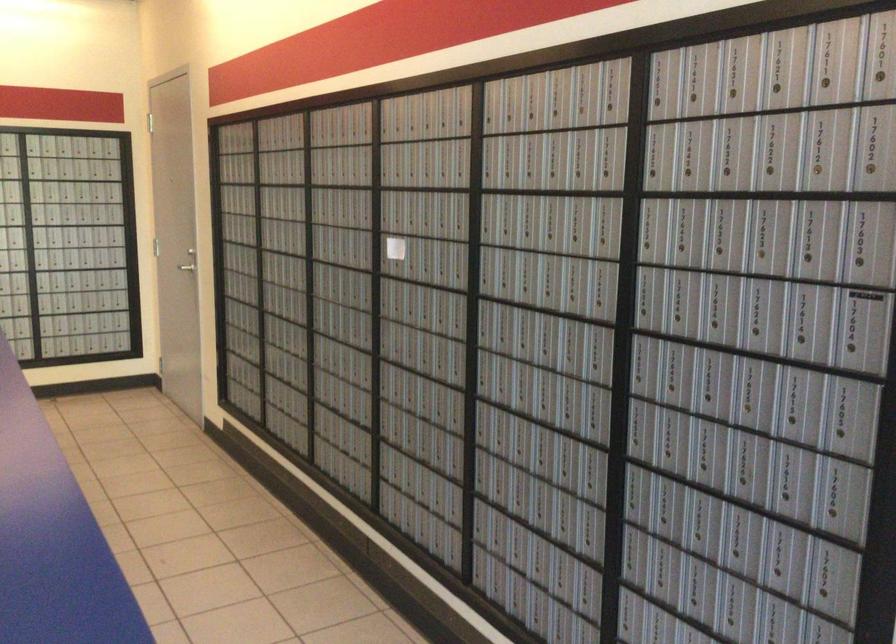
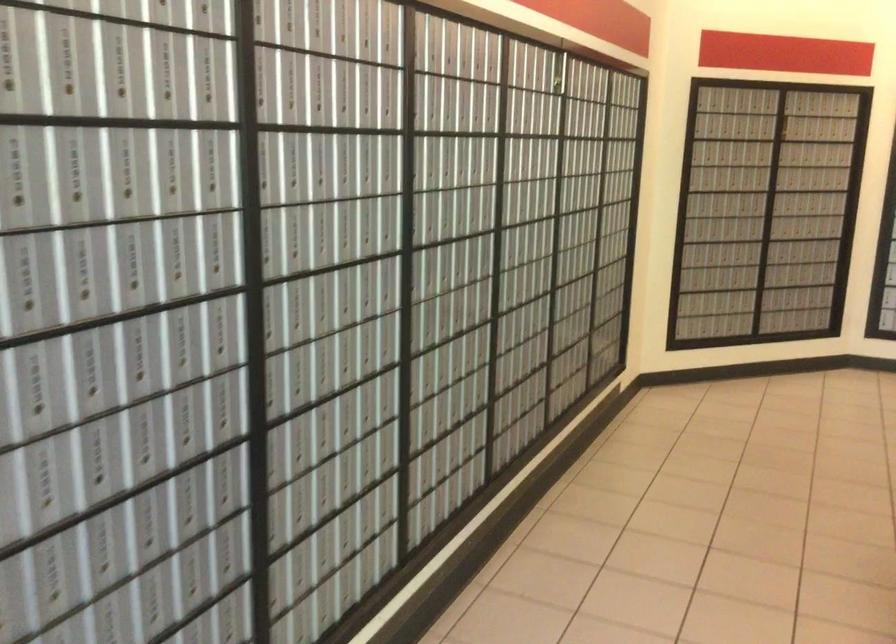
Question: The first image is from the beginning of the video and the second image is from the end. How did the camera likely rotate when shooting the video?

Choices:
 (A) Left
 (B) Right
 (C) Up
 (D) Down

Answer: (A)